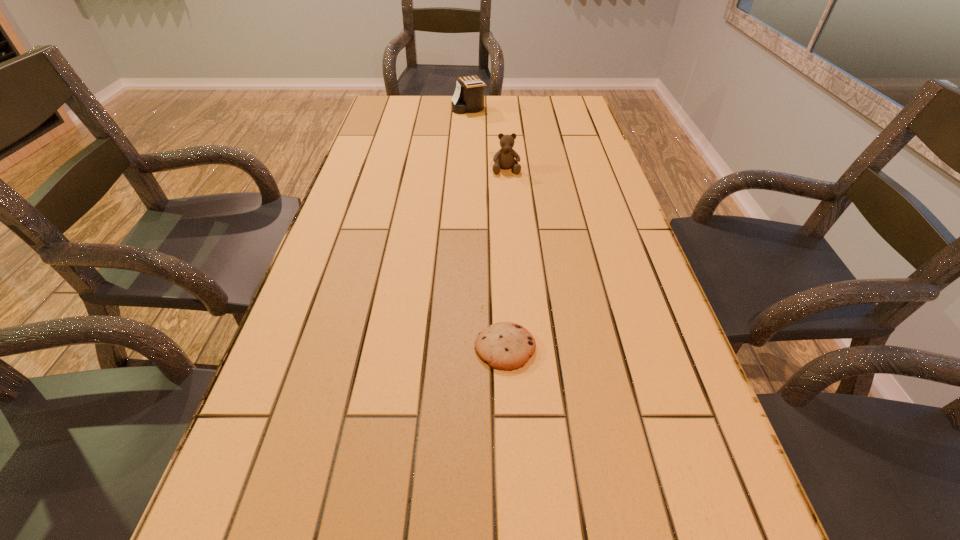
This screenshot has height=540, width=960. What are the coordinates of `free location at the right edge` in the screenshot? It's located at point(593,140).

Image resolution: width=960 pixels, height=540 pixels. What are the coordinates of `blank area at the far left corner` in the screenshot? It's located at (416, 106).

Where is `vacant space that's between the farthest object and the teddy bear`? This screenshot has width=960, height=540. vacant space that's between the farthest object and the teddy bear is located at coordinates (488, 139).

Find the location of a particular element. The image size is (960, 540). free space that is in between the farthest object and the cookie is located at coordinates (487, 228).

Locate an element on the screen. Image resolution: width=960 pixels, height=540 pixels. free space between the teddy bear and the farthest object is located at coordinates (488, 139).

You are a GUI agent. You are given a task and a screenshot of the screen. Output one action in this format:
    pyautogui.click(x=<x>, y=<y>)
    Task: Click on the vacant space in between the calculator and the cookie
    This screenshot has height=540, width=960.
    Given the screenshot: What is the action you would take?
    pyautogui.click(x=487, y=228)

Locate an element on the screen. Image resolution: width=960 pixels, height=540 pixels. free spot between the nearest object and the second farthest object is located at coordinates (506, 258).

The height and width of the screenshot is (540, 960). What are the coordinates of `the second closest object to the calculator` in the screenshot? It's located at (508, 346).

Point out which object is positioned as the nearest to the calculator. Please provide its 2D coordinates. Your answer should be formatted as a tuple, i.e. [(x, y)], where the tuple contains the x and y coordinates of a point satisfying the conditions above.

[(504, 158)]